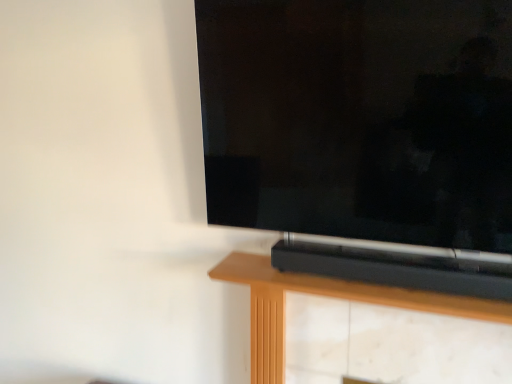
Question: Should I look upward or downward to see matte black tv at center?

Choices:
 (A) up
 (B) down

Answer: (A)

Question: From the image's perspective, is black plastic soundbar at center over matte black tv at center?

Choices:
 (A) yes
 (B) no

Answer: (B)

Question: Is black plastic soundbar at center to the right of matte black tv at center from the viewer's perspective?

Choices:
 (A) no
 (B) yes

Answer: (B)

Question: From the image's perspective, is black plastic soundbar at center beneath matte black tv at center?

Choices:
 (A) no
 (B) yes

Answer: (B)

Question: Does black plastic soundbar at center lie in front of matte black tv at center?

Choices:
 (A) yes
 (B) no

Answer: (B)

Question: From a real-world perspective, is black plastic soundbar at center physically above matte black tv at center?

Choices:
 (A) no
 (B) yes

Answer: (A)

Question: Does black plastic soundbar at center turn towards matte black tv at center?

Choices:
 (A) no
 (B) yes

Answer: (A)

Question: Can you confirm if matte black tv at center is wider than black plastic soundbar at center?

Choices:
 (A) no
 (B) yes

Answer: (A)

Question: Does matte black tv at center come in front of black plastic soundbar at center?

Choices:
 (A) yes
 (B) no

Answer: (A)

Question: Can you confirm if matte black tv at center is taller than black plastic soundbar at center?

Choices:
 (A) no
 (B) yes

Answer: (B)

Question: Are matte black tv at center and black plastic soundbar at center located far from each other?

Choices:
 (A) no
 (B) yes

Answer: (A)

Question: Is matte black tv at center at the right side of black plastic soundbar at center?

Choices:
 (A) yes
 (B) no

Answer: (B)

Question: Considering the relative sizes of matte black tv at center and black plastic soundbar at center in the image provided, is matte black tv at center thinner than black plastic soundbar at center?

Choices:
 (A) yes
 (B) no

Answer: (A)

Question: Does point (266, 125) appear closer or farther from the camera than point (275, 331)?

Choices:
 (A) farther
 (B) closer

Answer: (B)